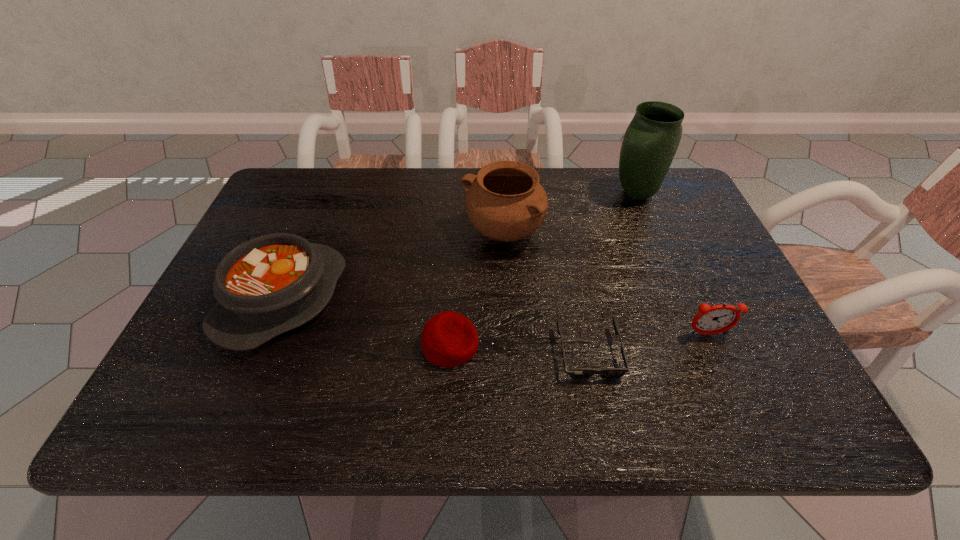
The image size is (960, 540). What are the coordinates of `free space at the near edge` in the screenshot? It's located at (378, 410).

Locate an element on the screen. The height and width of the screenshot is (540, 960). free space at the left edge of the desktop is located at coordinates point(244,370).

Locate an element on the screen. This screenshot has width=960, height=540. vacant space at the right edge of the desktop is located at coordinates [696, 303].

In the image, there is a desktop. Where is `vacant area at the far left corner`? vacant area at the far left corner is located at coordinates (287, 201).

The image size is (960, 540). In order to click on vacant area at the far right corner in this screenshot , I will do `click(694, 205)`.

This screenshot has width=960, height=540. I want to click on vacant region between the tallest object and the shortest object, so click(x=612, y=273).

Locate an element on the screen. vacant area that lies between the sunglasses and the vase is located at coordinates (612, 273).

At what (x,y) coordinates should I click in order to perform the action: click on free space between the pottery and the casserole. Please return your answer as a coordinate pair (x, y). Looking at the image, I should click on (393, 266).

This screenshot has width=960, height=540. I want to click on empty space between the fifth tallest object and the alarm clock, so click(579, 340).

Find the location of a particular element. The height and width of the screenshot is (540, 960). unoccupied area between the second shortest object and the shortest object is located at coordinates (519, 349).